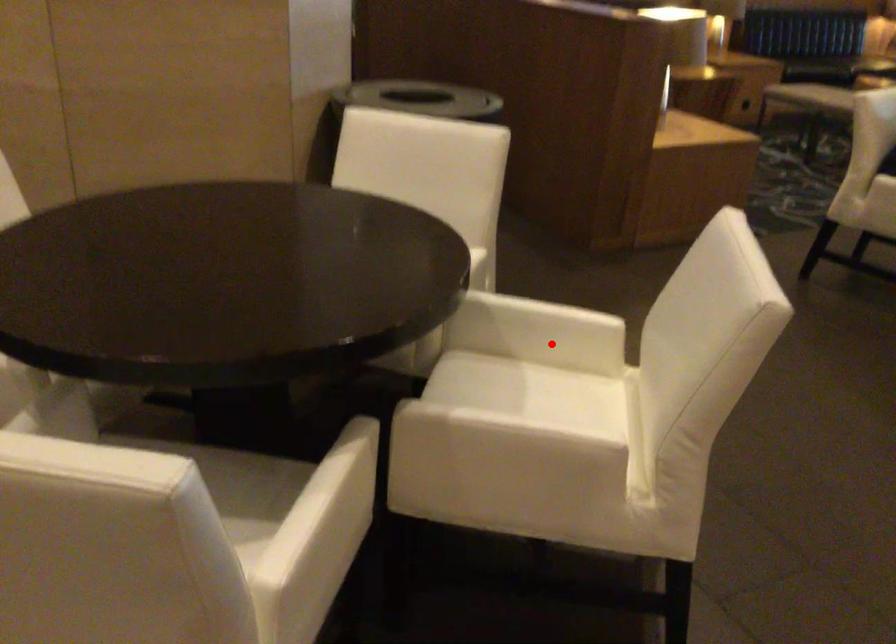
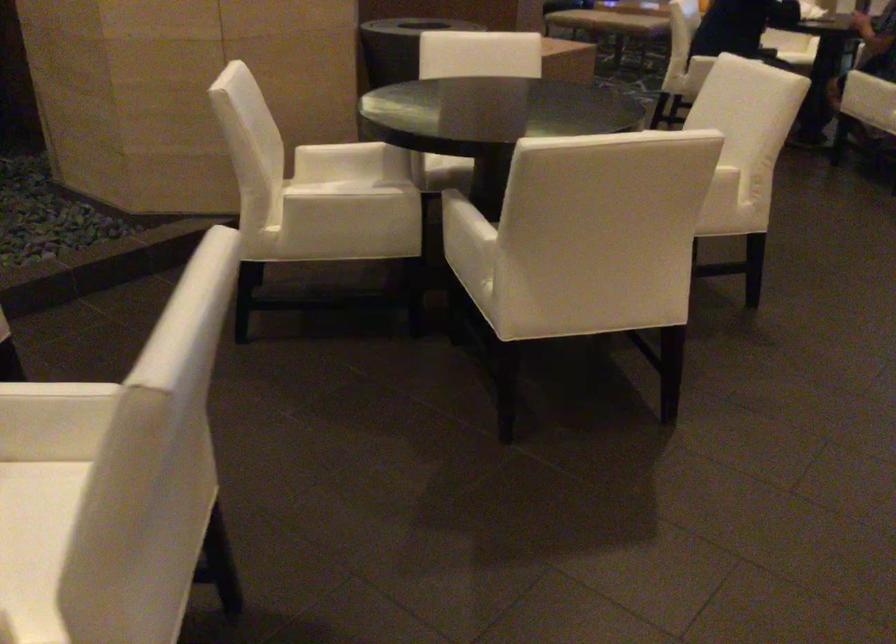
Question: I am providing you with two images of the same scene from different viewpoints. A red point is marked on the first image. Is the red point's position out of view in image 2?

Choices:
 (A) Yes
 (B) No

Answer: (A)